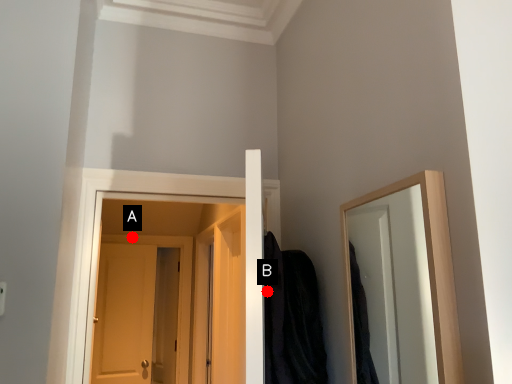
Question: Two points are circled on the image, labeled by A and B beside each circle. Which point is farther from the camera taking this photo?

Choices:
 (A) A is further
 (B) B is further

Answer: (A)